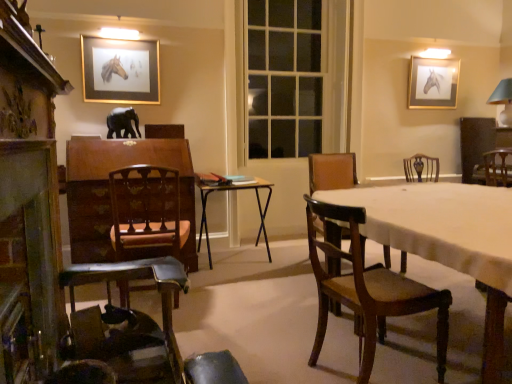
Locate an element on the screen. vacant space to the right of wooden chair at left, the third chair in the back-to-front sequence is located at coordinates (219, 302).